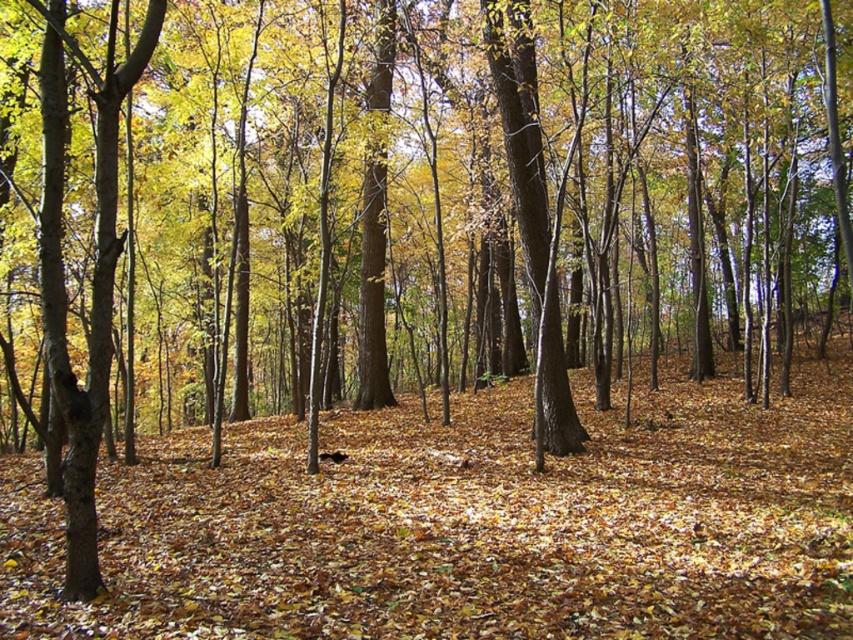
Which of these two, brown leaf litter at center or smooth brown tree trunk at center, stands taller?

brown leaf litter at center is taller.

Is point (53, 500) behind point (564, 417)?

No.

Where is `brown leaf litter at center`? brown leaf litter at center is located at coordinates (467, 524).

Between smooth brown tree trunk at left and smooth brown tree trunk at center, which one is positioned lower?

smooth brown tree trunk at left

Who is shorter, smooth brown tree trunk at left or smooth brown tree trunk at center?

smooth brown tree trunk at center

This screenshot has width=853, height=640. Identify the location of smooth brown tree trunk at left. (91, 272).

Who is higher up, brown leaf litter at center or smooth brown tree trunk at left?

smooth brown tree trunk at left is above.

Is point (206, 580) farther from camera compared to point (73, 544)?

Yes, point (206, 580) is farther from viewer.

Which is in front, point (757, 456) or point (109, 104)?

Positioned in front is point (109, 104).

This screenshot has width=853, height=640. What are the coordinates of `brown leaf litter at center` in the screenshot? It's located at (467, 524).